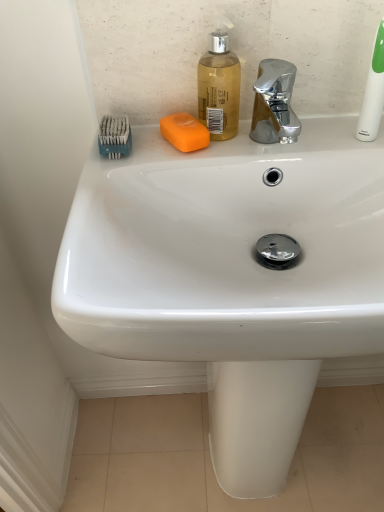
What are the coordinates of `free location to the right of orange matte soap at center` in the screenshot? It's located at pos(290,141).